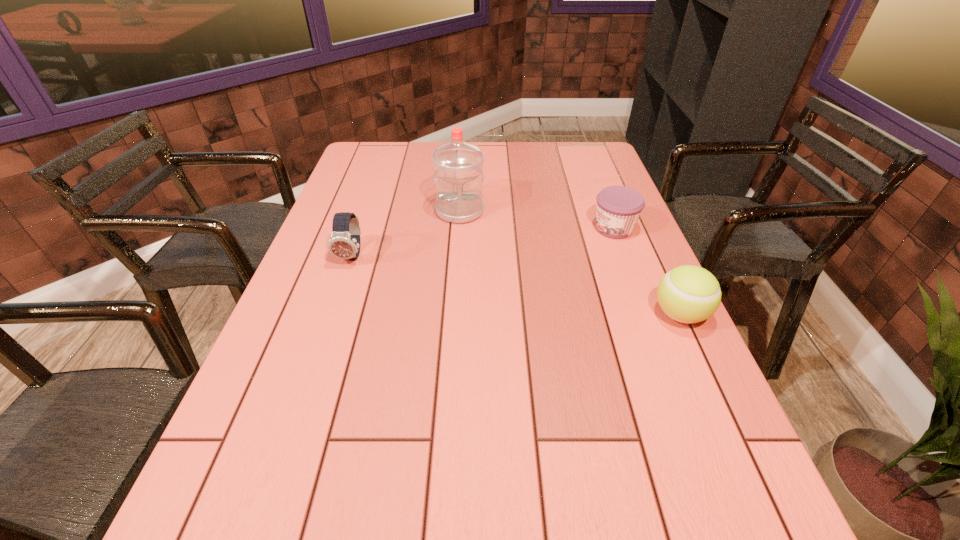
Locate an element on the screen. The width and height of the screenshot is (960, 540). watch is located at coordinates (344, 243).

You are a GUI agent. You are given a task and a screenshot of the screen. Output one action in this format:
    pyautogui.click(x=<x>, y=<y>)
    Task: Click on the leftmost object
    The image size is (960, 540).
    Given the screenshot: What is the action you would take?
    pyautogui.click(x=344, y=243)

This screenshot has height=540, width=960. Find the location of `tennis ball`. tennis ball is located at coordinates (689, 294).

Identify the location of the shortest object. (618, 207).

In order to click on the tallest object in this screenshot , I will do `click(458, 176)`.

Where is `the second object from left to right`? the second object from left to right is located at coordinates (458, 176).

Image resolution: width=960 pixels, height=540 pixels. In order to click on free location located 0.120m on the face of the watch in this screenshot , I will do `click(337, 301)`.

This screenshot has width=960, height=540. Identify the location of free region located 0.140m on the back of the tennis ball. (654, 259).

Where is `vacant space located on the front label of the shortest object`? This screenshot has height=540, width=960. vacant space located on the front label of the shortest object is located at coordinates pos(549,254).

Where is `free location located 0.380m on the front label of the shortest object`? The height and width of the screenshot is (540, 960). free location located 0.380m on the front label of the shortest object is located at coordinates (483, 281).